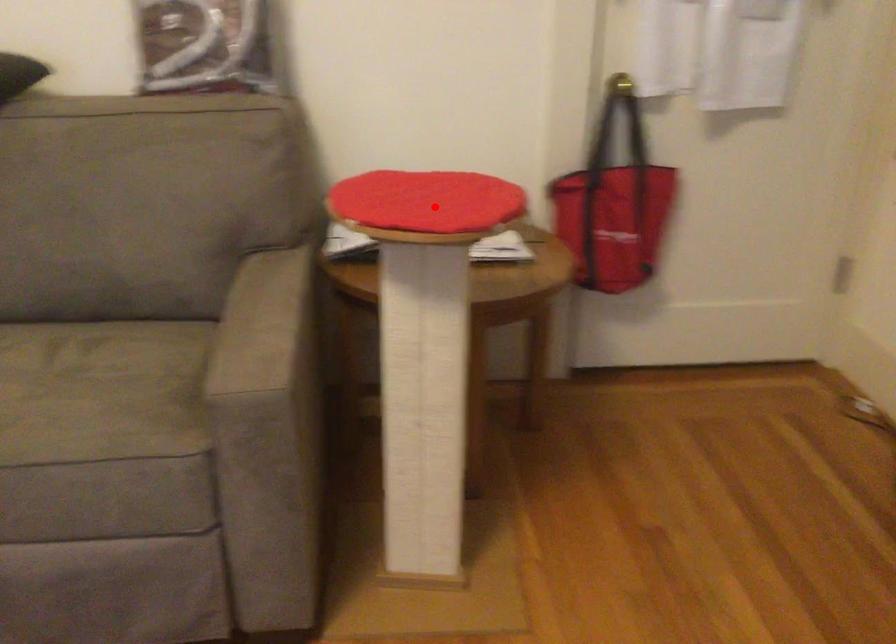
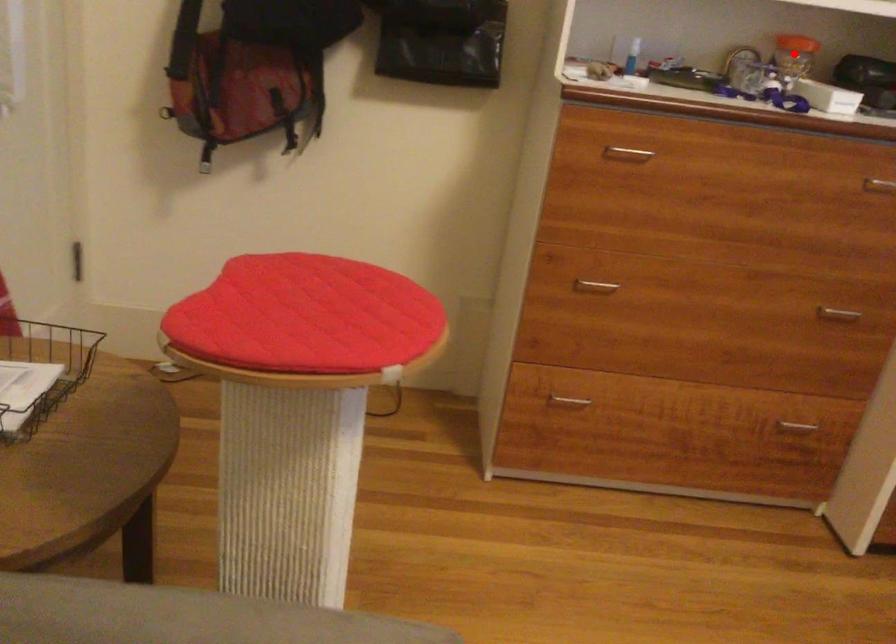
I am providing you with two images of the same scene from different viewpoints. A red point is marked on the first image and another point is marked on the second image. Does the point marked in image1 correspond to the same location as the one in image2?

No